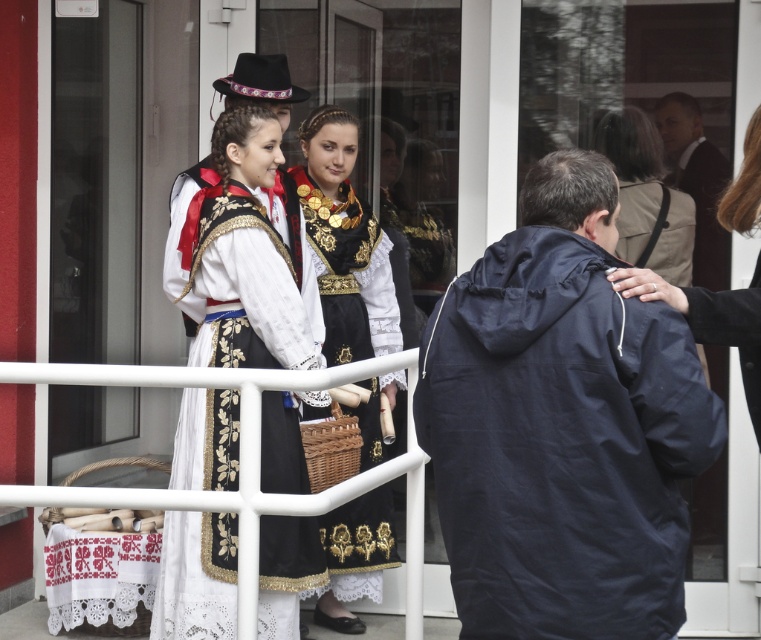
You are standing in the scene and want to place a small decoration exactly at the point marked as point (562, 426). Which object from the scene will this decoration be placed on?

The decoration will be placed on the navy blue jacket at right, as point (562, 426) is located on that object.